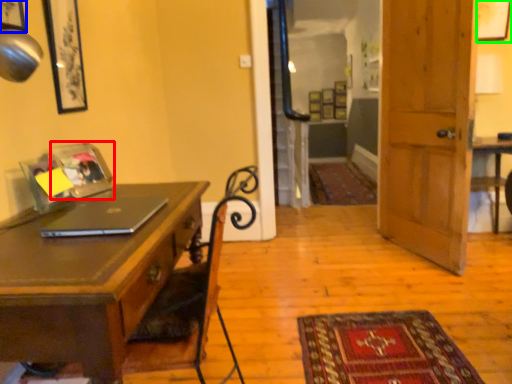
Question: Which object is positioned closest to picture frame (highlighted by a red box)? Select from picture frame (highlighted by a blue box) and picture frame (highlighted by a green box).

Choices:
 (A) picture frame
 (B) picture frame

Answer: (A)